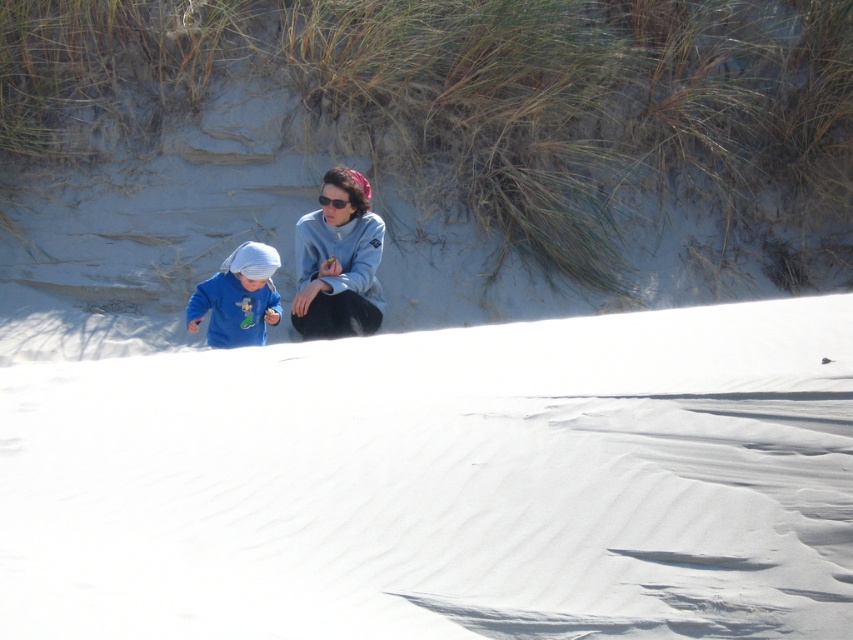
Question: Is white powdery snow at center above matte blue shirt at lower left?

Choices:
 (A) no
 (B) yes

Answer: (A)

Question: Which point is farther from the camera taking this photo?

Choices:
 (A) (352, 298)
 (B) (550, 8)
 (C) (212, 289)

Answer: (B)

Question: Does white powdery snow at center have a lesser width compared to black plastic sunglasses at center?

Choices:
 (A) no
 (B) yes

Answer: (A)

Question: Which of the following is the closest to the observer?

Choices:
 (A) (329, 106)
 (B) (334, 208)

Answer: (B)

Question: Among these points, which one is nearest to the camera?

Choices:
 (A) (328, 292)
 (B) (270, 248)
 (C) (634, 365)

Answer: (C)

Question: Is smooth sand dune at center positioned behind matte blue sweater at center?

Choices:
 (A) yes
 (B) no

Answer: (A)